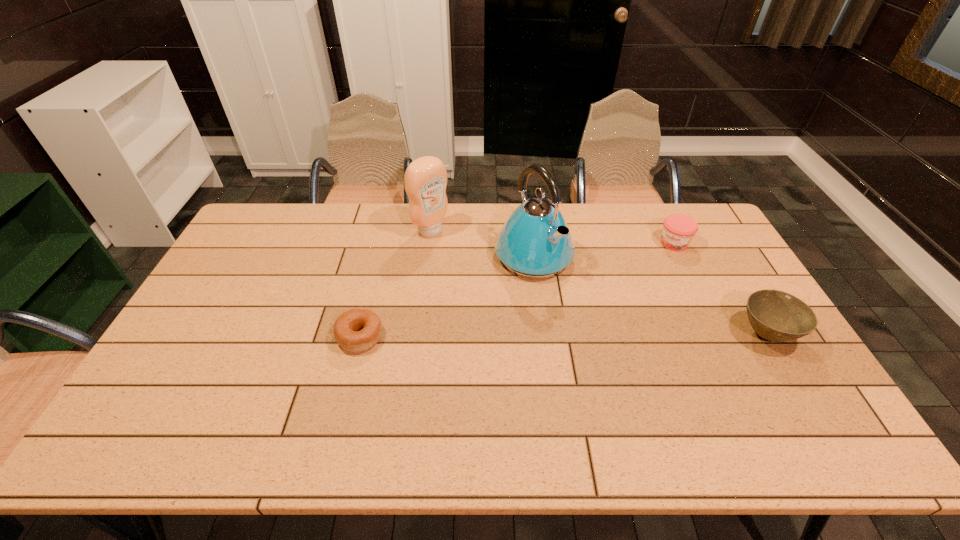
Find the location of a particular element. The image size is (960, 540). bagel is located at coordinates (356, 330).

Where is `the shortest object`? the shortest object is located at coordinates (356, 330).

Where is `bowl`? bowl is located at coordinates (777, 316).

Image resolution: width=960 pixels, height=540 pixels. Find the location of `jam`. jam is located at coordinates (678, 230).

Where is `the third object from right to left`? the third object from right to left is located at coordinates (535, 242).

This screenshot has height=540, width=960. Identify the location of kettle. (535, 242).

Identify the location of the fourth object from right to left. (425, 179).

Identify the location of condiment. The width and height of the screenshot is (960, 540). (425, 179).

This screenshot has height=540, width=960. Identify the location of vacant region located 0.170m on the right of the shortest object. (444, 336).

At what (x,y) coordinates should I click in order to perform the action: click on vacant space located on the back of the bowl. Please return your answer as a coordinate pair (x, y). The image size is (960, 540). Looking at the image, I should click on (732, 278).